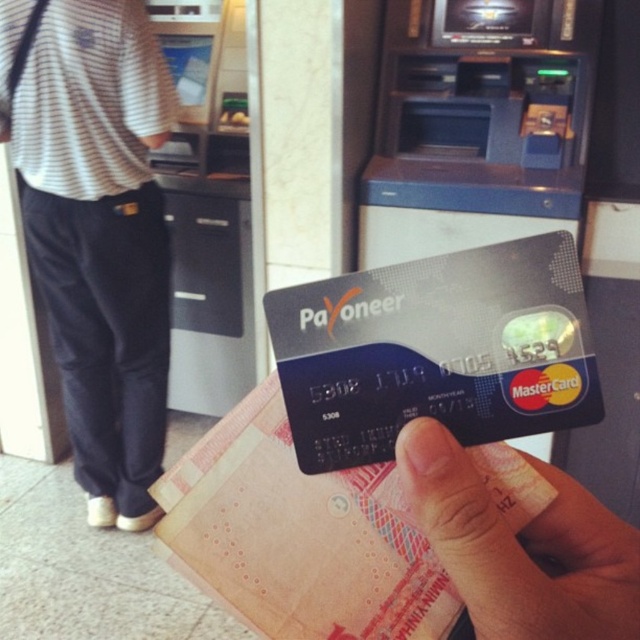
You are a security guard in the bank and need to verify the distance between the striped cotton shirt at upper left and the smooth skin hand at center. Which object is taller?

The striped cotton shirt at upper left is taller than the smooth skin hand at center.

You are a delivery person standing at the entrance of the bank. You need to hand over a package to the person wearing the striped cotton shirt at upper left. The delivery robot you are using is 1.2 meters tall. Can the robot reach the person without any obstruction?

The distance between the striped cotton shirt at upper left and the camera is 1.47 meters. Since the robot is 1.2 meters tall, it can reach the person as the distance is greater than the robot height, so there should be no obstruction.